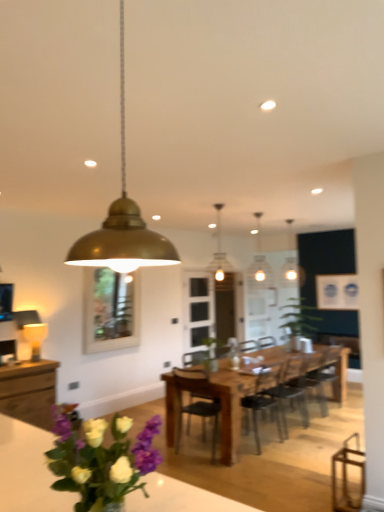
Question: Is there a large distance between wooden cabinet at lower left and white glass pendant light at center, marked as the first lamp in a back-to-front arrangement?

Choices:
 (A) yes
 (B) no

Answer: (A)

Question: Can you confirm if wooden cabinet at lower left is bigger than white glass pendant light at center, which ranks as the 4th lamp in front-to-back order?

Choices:
 (A) yes
 (B) no

Answer: (A)

Question: Is wooden cabinet at lower left thinner than white glass pendant light at center, marked as the first lamp in a back-to-front arrangement?

Choices:
 (A) no
 (B) yes

Answer: (A)

Question: Does wooden cabinet at lower left have a greater height compared to white glass pendant light at center, which ranks as the 4th lamp in front-to-back order?

Choices:
 (A) no
 (B) yes

Answer: (A)

Question: Could you tell me if wooden cabinet at lower left is facing white glass pendant light at center, which ranks as the 4th lamp in front-to-back order?

Choices:
 (A) no
 (B) yes

Answer: (A)

Question: Is wooden cabinet at lower left completely or partially outside of white glass pendant light at center, the first lamp positioned from the right?

Choices:
 (A) yes
 (B) no

Answer: (A)

Question: Considering the relative sizes of gold metallic pendant light at upper center, which appears as the fourth lamp when viewed from the back, and wooden dining table at center in the image provided, is gold metallic pendant light at upper center, which appears as the fourth lamp when viewed from the back, bigger than wooden dining table at center?

Choices:
 (A) no
 (B) yes

Answer: (A)

Question: Is gold metallic pendant light at upper center, the 3th lamp when ordered from right to left, in contact with wooden dining table at center?

Choices:
 (A) yes
 (B) no

Answer: (B)

Question: From a real-world perspective, is gold metallic pendant light at upper center, the 3th lamp when ordered from right to left, physically above wooden dining table at center?

Choices:
 (A) yes
 (B) no

Answer: (A)

Question: Could you tell me if gold metallic pendant light at upper center, the 3th lamp when ordered from right to left, is facing wooden dining table at center?

Choices:
 (A) yes
 (B) no

Answer: (B)

Question: Is gold metallic pendant light at upper center, the 3th lamp when ordered from right to left, oriented away from wooden dining table at center?

Choices:
 (A) yes
 (B) no

Answer: (B)

Question: Considering the relative positions of gold metallic pendant light at upper center, which ranks as the second lamp in left-to-right order, and wooden dining table at center in the image provided, is gold metallic pendant light at upper center, which ranks as the second lamp in left-to-right order, to the right of wooden dining table at center from the viewer's perspective?

Choices:
 (A) no
 (B) yes

Answer: (A)

Question: Would you say wooden dining table at center contains white glass pendant light at center, marked as the first lamp in a back-to-front arrangement?

Choices:
 (A) no
 (B) yes

Answer: (A)